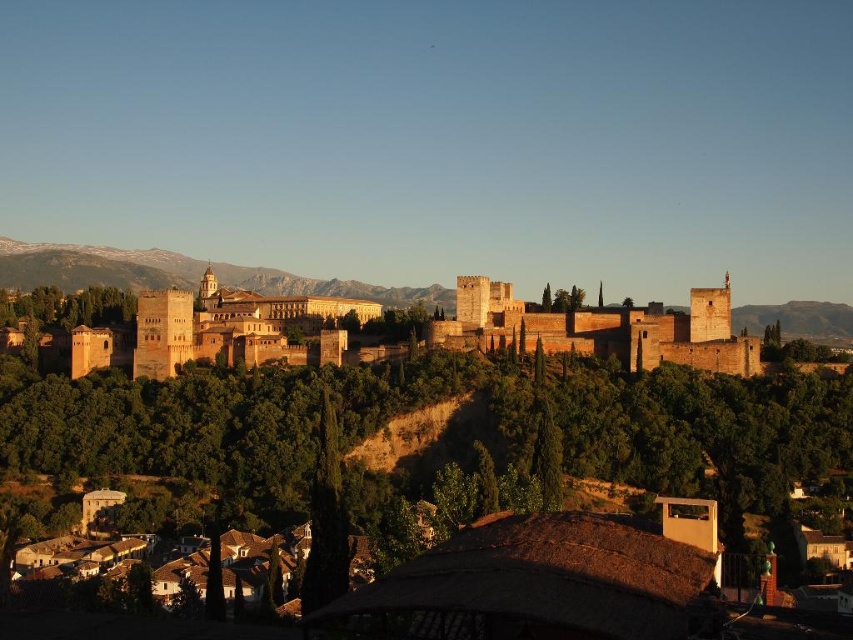
You are standing at the base of the hill looking up at the fortress. There is a green leafy tree at center. Is the point marked at coordinate (447, 428) on the fortress wall or on the green leafy tree at center?

The point marked at coordinate (447, 428) is on the green leafy tree at center according to the description.

You are an architect planning to build a new observation deck. You need to choose between placing it near the green leafy tree at center or the snowy rock formation at upper left. Which location would allow for a larger deck due to the available space?

The green leafy tree at center is larger in size than the snowy rock formation at upper left, so placing the observation deck near the green leafy tree at center would allow for a larger deck due to the available space.

You are standing at the base of the hill looking up at the fortress. You notice a green leafy tree at center and a snowy rock formation at upper left. Which object is closer to you?

The green leafy tree at center is closer to the viewer than the snowy rock formation at upper left.